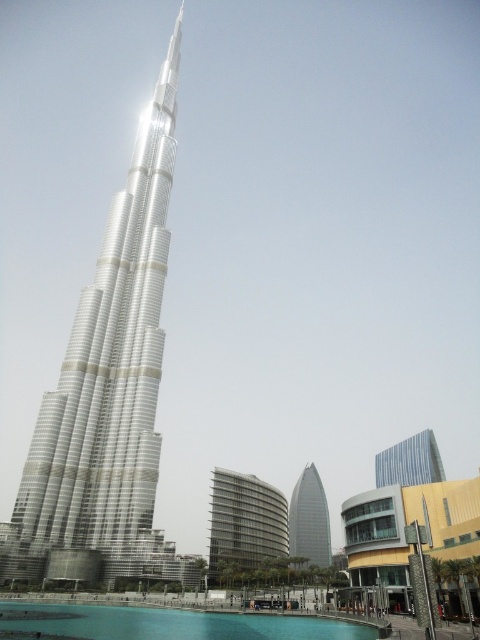
You are standing in front of the Burj Khalifa and want to take a photo of the green glass pool at lower center. Where should you position yourself to capture it in the frame?

You should position yourself at point (x=169, y=624) to capture the green glass pool at lower center in the frame.

You are standing in front of two metallic glass structures in Dubai. You notice that one is significantly taller than the other. Which object is shorter between the metallic glass building at center and the metallic glass tower at center?

The metallic glass building at center is shorter compared to the metallic glass tower at center.